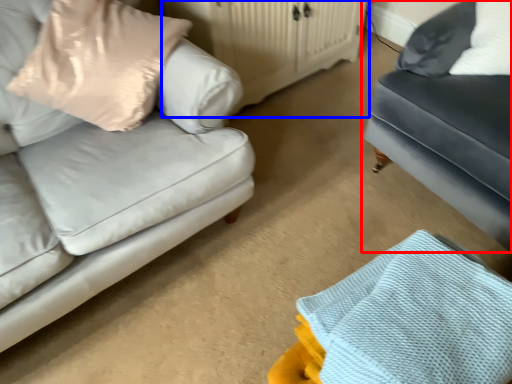
Question: Which of the following is the closest to the observer, studio couch (highlighted by a red box) or dresser (highlighted by a blue box)?

Choices:
 (A) studio couch
 (B) dresser

Answer: (A)